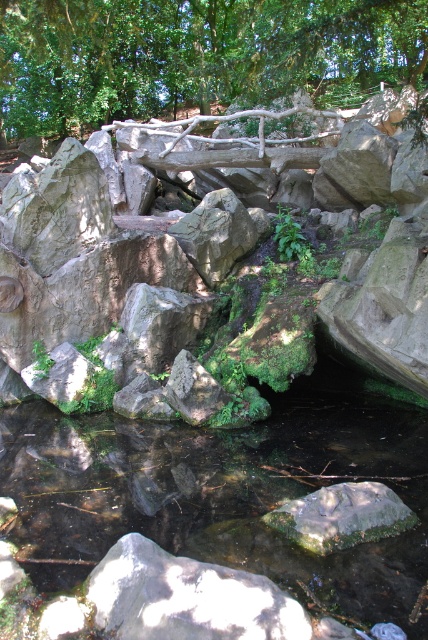
Is rough gray rock at center smaller than clear water at center?

Incorrect, rough gray rock at center is not smaller in size than clear water at center.

Is rough gray rock at center thinner than clear water at center?

No.

Between point (79, 280) and point (376, 595), which one is positioned in front?

Point (376, 595)

Locate an element on the screen. The width and height of the screenshot is (428, 640). rough gray rock at center is located at coordinates (100, 260).

Does clear water at center appear over green mossy rock at center?

Correct, clear water at center is located above green mossy rock at center.

Does clear water at center have a greater width compared to green mossy rock at center?

Yes.

Where is `clear water at center`? This screenshot has height=640, width=428. clear water at center is located at coordinates (225, 490).

Does rough gray rock at center have a smaller size compared to green mossy rock at center?

No, rough gray rock at center is not smaller than green mossy rock at center.

Locate an element on the screen. This screenshot has width=428, height=640. rough gray rock at center is located at coordinates (x=100, y=260).

Does point (425, 156) come in front of point (326, 516)?

No, it is not.

What are the coordinates of `rough gray rock at center` in the screenshot? It's located at (100, 260).